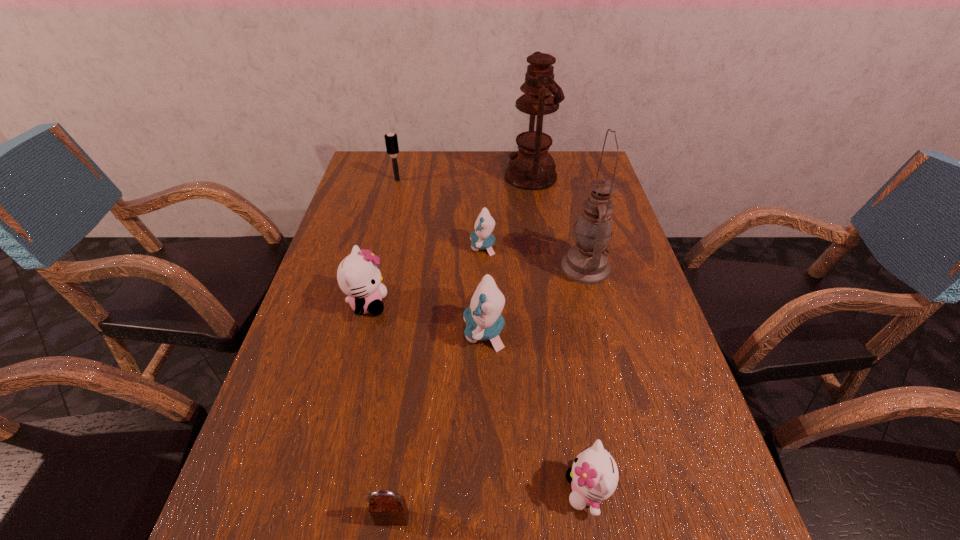
This screenshot has width=960, height=540. What are the coordinates of `vacant space located on the front-facing side of the smaller white kitten` in the screenshot? It's located at (502, 490).

Where is `vacant area situated 0.350m on the front-facing side of the smaller white kitten`? vacant area situated 0.350m on the front-facing side of the smaller white kitten is located at coordinates (364, 490).

Locate an element on the screen. Image resolution: width=960 pixels, height=540 pixels. vacant area situated on the face of the smaller blue kitten is located at coordinates pyautogui.click(x=388, y=246).

You are a GUI agent. You are given a task and a screenshot of the screen. Output one action in this format:
    pyautogui.click(x=<x>, y=<y>)
    Task: Click on the free space located 0.390m on the face of the smaller blue kitten
    The width and height of the screenshot is (960, 540).
    Given the screenshot: What is the action you would take?
    pyautogui.click(x=331, y=246)

The height and width of the screenshot is (540, 960). Find the location of `free space located 0.170m on the face of the smaller blue kitten`. free space located 0.170m on the face of the smaller blue kitten is located at coordinates (409, 246).

Find the location of a particular element. oil lamp that is at the far edge is located at coordinates pyautogui.click(x=530, y=168).

Identify the location of hairbrush that is at the far edge. Image resolution: width=960 pixels, height=540 pixels. (391, 139).

Identify the location of hairbrush present at the left edge. (391, 139).

Locate an element on the screen. Image resolution: width=960 pixels, height=540 pixels. kitten present at the left edge is located at coordinates (358, 275).

The width and height of the screenshot is (960, 540). Identify the location of object that is positioned at the far left corner. (391, 139).